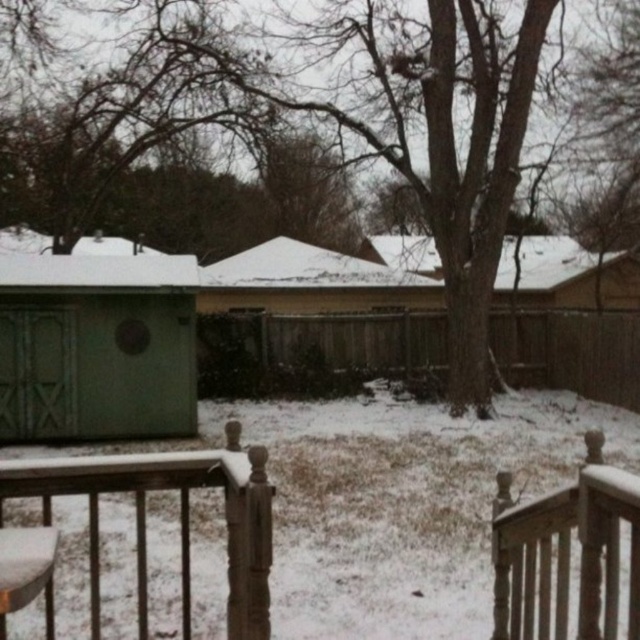
Is point (147, 545) closer to camera compared to point (525, 573)?

No, (147, 545) is further to viewer.

Can you confirm if wooden railing at lower center is positioned to the left of white wood railing at lower right?

Yes, wooden railing at lower center is to the left of white wood railing at lower right.

Between point (490, 582) and point (506, 582), which one is positioned in front?

Point (506, 582) is more forward.

Identify the location of wooden railing at lower center. This screenshot has width=640, height=640. (168, 532).

From the picture: Between brown wooden fence at center and white wood railing at lower right, which one appears on the right side from the viewer's perspective?

Positioned to the right is brown wooden fence at center.

Is brown wooden fence at center taller than white wood railing at lower right?

Correct, brown wooden fence at center is much taller as white wood railing at lower right.

At what (x,y) coordinates should I click in order to perform the action: click on brown wooden fence at center. Please return your answer as a coordinate pair (x, y). The image size is (640, 640). Looking at the image, I should click on (333, 339).

Is point (435, 353) closer to camera compared to point (636, 292)?

Yes.

Which is in front, point (323, 316) or point (563, 243)?

Point (323, 316) is in front.

Where is `brown wooden fence at center`? This screenshot has height=640, width=640. brown wooden fence at center is located at coordinates pos(333,339).